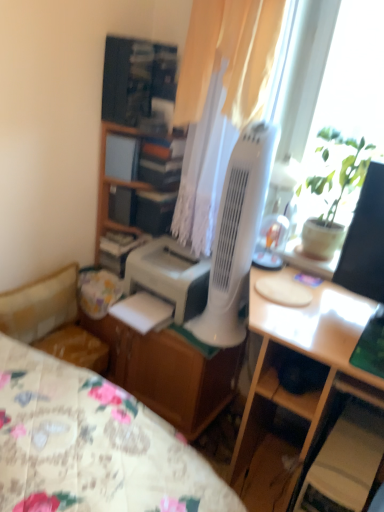
This screenshot has width=384, height=512. I want to click on white matte printer at center, so click(169, 276).

You are a GUI agent. You are given a task and a screenshot of the screen. Output one action in this format:
    pyautogui.click(x=<x>, y=<y>)
    Task: Click on the floral fabric studio couch at lower left
    Image resolution: width=384 pixels, height=512 pixels.
    Given the screenshot: What is the action you would take?
    pyautogui.click(x=52, y=320)

Image resolution: width=384 pixels, height=512 pixels. Find the location of `white sheer curtain at center`. white sheer curtain at center is located at coordinates (219, 101).

Measure the distance between point [267,170] and camera.

Point [267,170] is 1.54 meters away from camera.

This screenshot has height=512, width=384. What are the coordinates of `wooden cabinet at center-left` in the screenshot? It's located at (113, 185).

What do you see at coordinates (113, 185) in the screenshot? I see `wooden cabinet at center-left` at bounding box center [113, 185].

This screenshot has width=384, height=512. In order to click on white matte printer at center in this screenshot , I will do `click(169, 276)`.

In the image, there is a floral fabric studio couch at lower left. Where is `mechanical fan above it (from the image's perspective)`? mechanical fan above it (from the image's perspective) is located at coordinates (236, 234).

Is white plastic mechanical fan at center completely or partially inside floral fabric studio couch at lower left?

No, white plastic mechanical fan at center is not inside floral fabric studio couch at lower left.

Which object is more forward, floral fabric studio couch at lower left or white plastic mechanical fan at center?

white plastic mechanical fan at center is more forward.

The height and width of the screenshot is (512, 384). In order to click on curtain that is above the green leafy plant at upper right (from a real-world perspective) in this screenshot , I will do `click(219, 101)`.

Is white sheer curtain at center in front of or behind green leafy plant at upper right in the image?

Clearly, white sheer curtain at center is in front of green leafy plant at upper right.

Which of these two, white sheer curtain at center or green leafy plant at upper right, stands taller?

With more height is white sheer curtain at center.

Is white plastic mechanical fan at center shorter than light wood desk at center?

Yes, white plastic mechanical fan at center is shorter than light wood desk at center.

Which of these two, white plastic mechanical fan at center or light wood desk at center, is smaller?

Smaller between the two is white plastic mechanical fan at center.

Is white plastic mechanical fan at center turned away from light wood desk at center?

white plastic mechanical fan at center does not have its back to light wood desk at center.

Considering the relative sizes of white matte printer at center and wooden bookshelf at upper center in the image provided, is white matte printer at center wider than wooden bookshelf at upper center?

Correct, the width of white matte printer at center exceeds that of wooden bookshelf at upper center.

Is point (153, 267) closer or farther from the camera than point (151, 110)?

Point (153, 267) is closer to the camera than point (151, 110).

Can you tell me how much white matte printer at center and wooden bookshelf at upper center differ in facing direction?

2.99 degrees.

Is white matte printer at center further to camera compared to wooden bookshelf at upper center?

No.

You are a GUI agent. You are given a task and a screenshot of the screen. Output one action in this format:
    pyautogui.click(x=<x>, y=<y>)
    Task: Click on the printer lying on the left of light wood desk at center
    The height and width of the screenshot is (512, 384).
    Given the screenshot: What is the action you would take?
    pyautogui.click(x=169, y=276)

Which is more to the left, white matte printer at center or light wood desk at center?

Positioned to the left is white matte printer at center.

From the image's perspective, which one is positioned higher, white matte printer at center or light wood desk at center?

white matte printer at center is shown above in the image.

Is white matte printer at center directly adjacent to light wood desk at center?

white matte printer at center is not next to light wood desk at center, and they're not touching.

In terms of height, does wooden cabinet at center-left look taller or shorter compared to white matte printer at center?

Clearly, wooden cabinet at center-left is taller compared to white matte printer at center.

How much distance is there between wooden cabinet at center-left and white matte printer at center?

A distance of 13.59 inches exists between wooden cabinet at center-left and white matte printer at center.

Is wooden cabinet at center-left in front of or behind white matte printer at center in the image?

In the image, wooden cabinet at center-left appears behind white matte printer at center.

Is wooden cabinet at center-left oriented towards white matte printer at center?

No.

Where is `shelf behind the floral fabric studio couch at lower left`? shelf behind the floral fabric studio couch at lower left is located at coordinates (139, 84).

Consider the image. Are floral fabric studio couch at lower left and wooden bookshelf at upper center located far from each other?

No.

Can you tell me how much floral fabric studio couch at lower left and wooden bookshelf at upper center differ in facing direction?

90.4 degrees.

Is point (98, 353) behind point (165, 56)?

No, (98, 353) is in front of (165, 56).

The width and height of the screenshot is (384, 512). What are the coordinates of `studio couch located below the white plastic mechanical fan at center (from the image's perspective)` in the screenshot? It's located at (52, 320).

This screenshot has height=512, width=384. Find the location of `curtain in front of the green leafy plant at upper right`. curtain in front of the green leafy plant at upper right is located at coordinates (219, 101).

From the image, which object appears to be farther from white plastic mechanical fan at center, wooden bookshelf at upper center or white sheer curtain at center?

wooden bookshelf at upper center.

Considering their positions, is white plastic mechanical fan at center positioned closer to white matte printer at center than light wood desk at center?

white plastic mechanical fan at center is closer to white matte printer at center.

Estimate the real-world distances between objects in this image. Which object is closer to wooden cabinet at center-left, white matte printer at center or white sheer curtain at center?

Among the two, white matte printer at center is located nearer to wooden cabinet at center-left.

Based on their spatial positions, is wooden cabinet at center-left or wooden bookshelf at upper center further from white plastic mechanical fan at center?

Based on the image, wooden bookshelf at upper center appears to be further to white plastic mechanical fan at center.

Estimate the real-world distances between objects in this image. Which object is closer to green leafy plant at upper right, white plastic mechanical fan at center or light wood desk at center?

white plastic mechanical fan at center lies closer to green leafy plant at upper right than the other object.

Considering their positions, is white sheer curtain at center positioned closer to green leafy plant at upper right than floral fabric studio couch at lower left?

Based on the image, white sheer curtain at center appears to be nearer to green leafy plant at upper right.

Which object lies nearer to the anchor point white plastic mechanical fan at center, light wood desk at center or white matte printer at center?

white matte printer at center is positioned closer to the anchor white plastic mechanical fan at center.

Considering their positions, is wooden file cabinet at center positioned further to green leafy plant at upper right than white plastic mechanical fan at center?

Based on the image, wooden file cabinet at center appears to be further to green leafy plant at upper right.

The height and width of the screenshot is (512, 384). Find the location of `curtain between wooden bookshelf at upper center and floral fabric studio couch at lower left from top to bottom`. curtain between wooden bookshelf at upper center and floral fabric studio couch at lower left from top to bottom is located at coordinates [x=219, y=101].

What are the coordinates of `mechanical fan between white sheer curtain at center and light wood desk at center vertically` in the screenshot? It's located at (236, 234).

Where is `mechanical fan between wooden cabinet at center-left and wooden file cabinet at center in the vertical direction`? The image size is (384, 512). mechanical fan between wooden cabinet at center-left and wooden file cabinet at center in the vertical direction is located at coordinates (236, 234).

You are a GUI agent. You are given a task and a screenshot of the screen. Output one action in this format:
    pyautogui.click(x=<x>, y=<y>)
    Task: Click on the printer between wooden bookshelf at upper center and light wood desk at center vertically
    This screenshot has height=512, width=384.
    Given the screenshot: What is the action you would take?
    pyautogui.click(x=169, y=276)